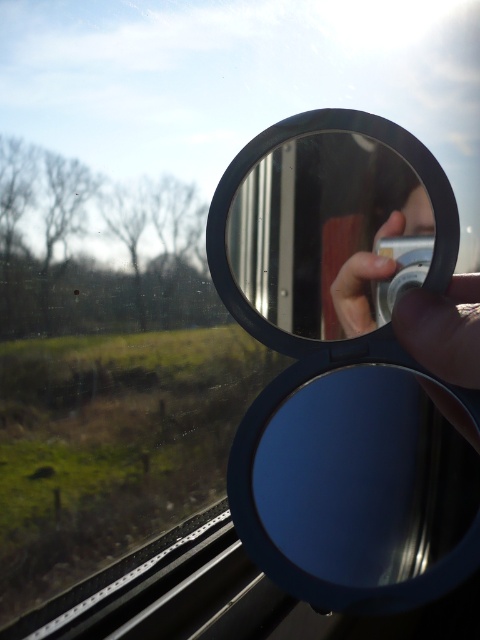
Does blue matte view mirror at center appear over blue metallic magnifying glass at center?

Indeed, blue matte view mirror at center is positioned over blue metallic magnifying glass at center.

Is point (333, 314) positioned after point (230, 476)?

That is True.

Locate an element on the screen. This screenshot has height=640, width=480. blue matte view mirror at center is located at coordinates (339, 371).

Which is in front, point (317, 380) or point (297, 292)?

Point (317, 380) is more forward.

This screenshot has width=480, height=640. I want to click on blue metallic magnifying glass at center, so click(x=354, y=488).

Is point (388, 352) less distant than point (322, 224)?

Yes, point (388, 352) is closer to viewer.

Who is more forward, (370,525) or (331,202)?

Point (370,525) is in front.

Is point (373, 522) closer to viewer compared to point (331, 168)?

Yes, it is.

You are a GUI agent. You are given a task and a screenshot of the screen. Output one action in this format:
    pyautogui.click(x=<x>, y=<y>)
    Task: Click on the blue matte view mirror at center
    
    Given the screenshot: What is the action you would take?
    pyautogui.click(x=339, y=371)